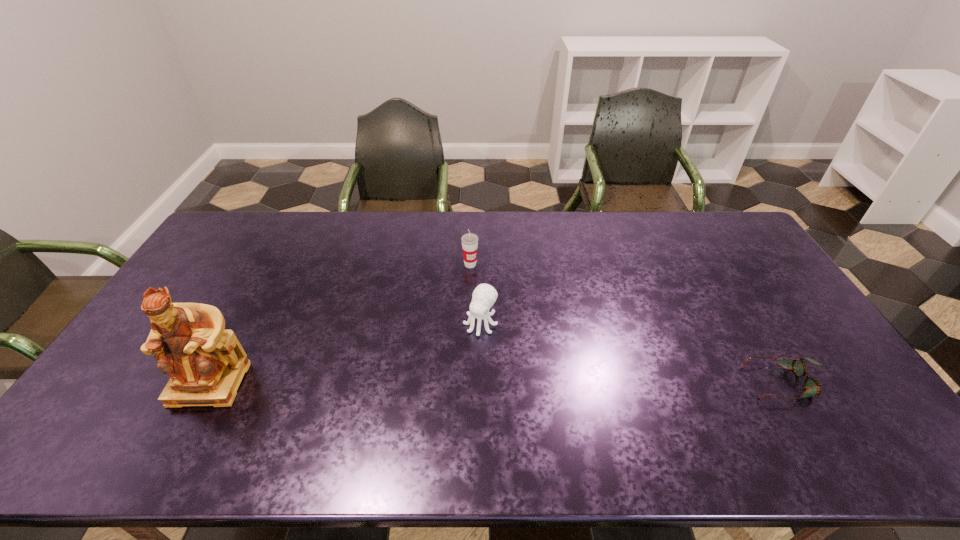
Where is `vacant spot on the desktop that is between the figurine and the rightmost object and is positioned on the front-facing side of the second farthest object`? vacant spot on the desktop that is between the figurine and the rightmost object and is positioned on the front-facing side of the second farthest object is located at coordinates pos(441,383).

At what (x,y) coordinates should I click in order to perform the action: click on free spot on the desktop that is between the leftmost object and the rightmost object and is positioned on the side of the second tallest object with the logo. Please return your answer as a coordinate pair (x, y). Image resolution: width=960 pixels, height=540 pixels. Looking at the image, I should click on (558, 383).